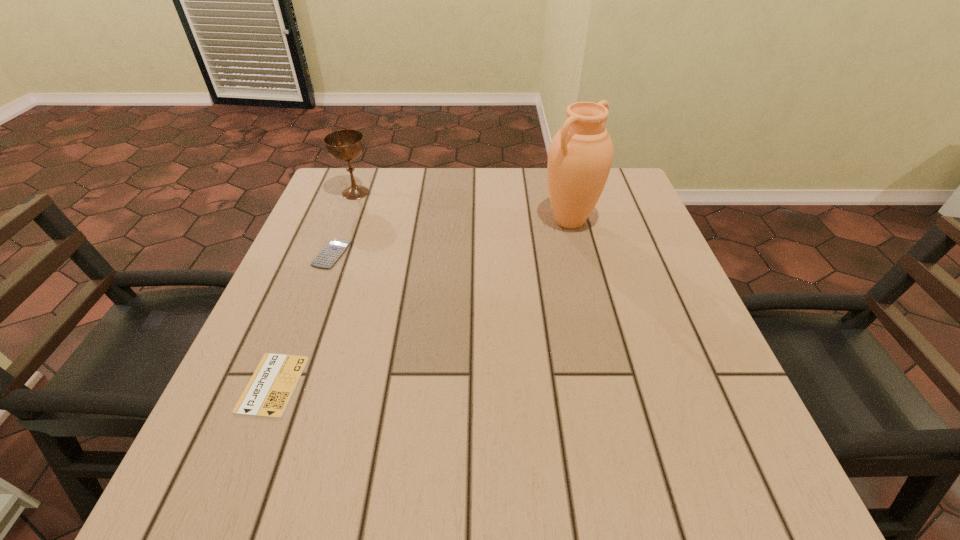
Identify the location of the rightmost object. (580, 155).

At what (x,y) coordinates should I click in order to perform the action: click on urn. Please return your answer as a coordinate pair (x, y). Looking at the image, I should click on (580, 155).

Identify the location of the third shortest object. This screenshot has width=960, height=540. (344, 145).

I want to click on the farthest object, so click(x=344, y=145).

You are a GUI agent. You are given a task and a screenshot of the screen. Output one action in this format:
    pyautogui.click(x=<x>, y=<y>)
    Task: Click on the calculator
    This screenshot has width=960, height=540.
    Given the screenshot: What is the action you would take?
    pyautogui.click(x=332, y=251)

Where is `the second shortest object`? The height and width of the screenshot is (540, 960). the second shortest object is located at coordinates (332, 251).

You are a GUI agent. You are given a task and a screenshot of the screen. Output one action in this format:
    pyautogui.click(x=<x>, y=<y>)
    Task: Click on the shortest object
    
    Given the screenshot: What is the action you would take?
    pyautogui.click(x=270, y=388)

The height and width of the screenshot is (540, 960). Find the location of `the nearest object`. the nearest object is located at coordinates (270, 388).

The image size is (960, 540). I want to click on free space located on the left of the tallest object, so click(x=485, y=221).

Locate an element on the screen. vacant space situated on the front of the farthest object is located at coordinates tap(320, 288).